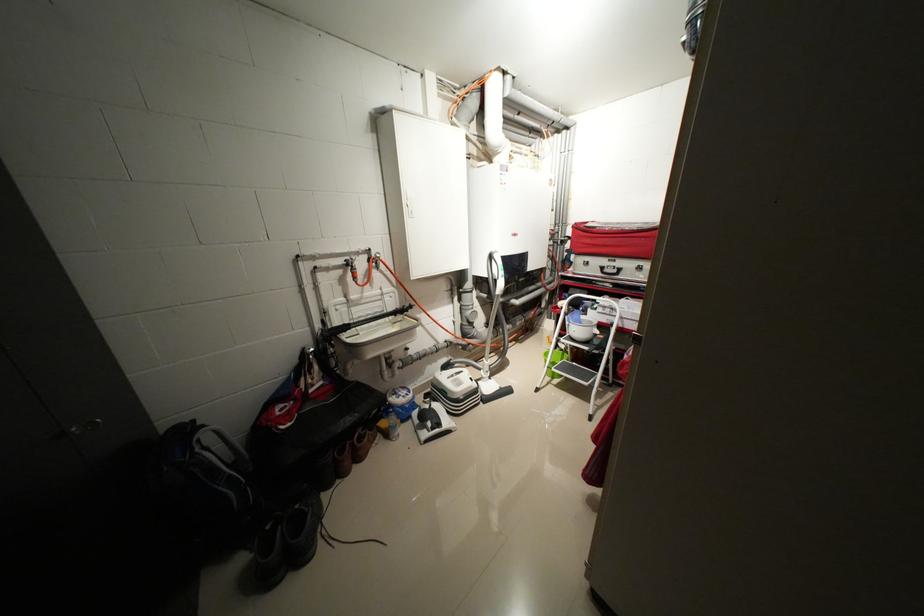
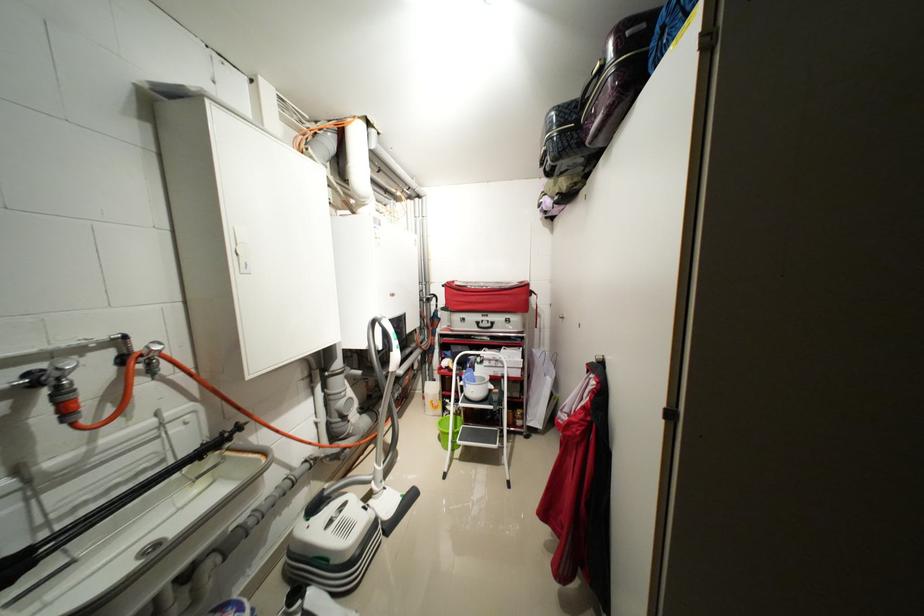
In the second image, find the point that corresponds to (355,257) in the first image.

(46, 367)